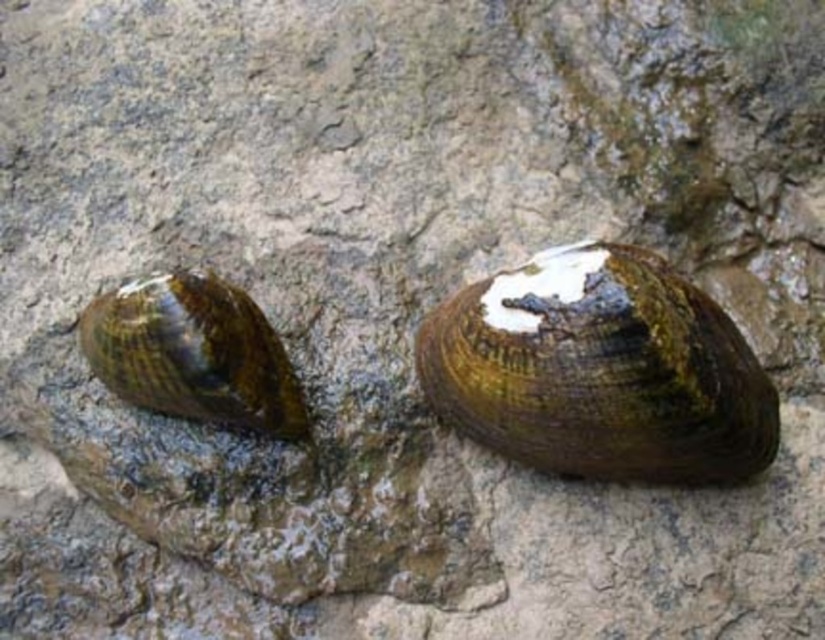
Question: Is the position of shiny brown shell at center more distant than that of shiny brown shell at left?

Choices:
 (A) no
 (B) yes

Answer: (A)

Question: Which point appears farthest from the camera in this image?

Choices:
 (A) (299, 422)
 (B) (620, 346)

Answer: (A)

Question: Is shiny brown shell at center positioned in front of shiny brown shell at left?

Choices:
 (A) no
 (B) yes

Answer: (B)

Question: Which point is farther to the camera?

Choices:
 (A) shiny brown shell at center
 (B) shiny brown shell at left

Answer: (B)

Question: Can you confirm if shiny brown shell at center is positioned to the left of shiny brown shell at left?

Choices:
 (A) no
 (B) yes

Answer: (A)

Question: Which point is farther from the camera taking this photo?

Choices:
 (A) (227, 321)
 (B) (448, 387)

Answer: (B)